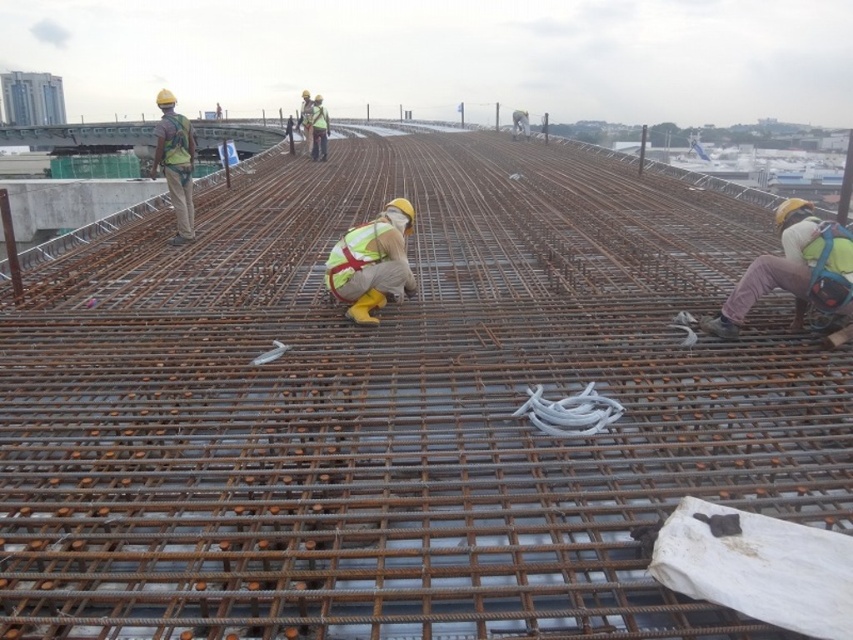
Question: Is light blue fabric at right above matte yellow safety vest at upper left?

Choices:
 (A) no
 (B) yes

Answer: (A)

Question: Does reflective safety vest at center lie in front of matte yellow safety vest at upper left?

Choices:
 (A) yes
 (B) no

Answer: (A)

Question: Which point appears farthest from the camera in this image?

Choices:
 (A) (399, 243)
 (B) (177, 154)
 (C) (804, 259)

Answer: (B)

Question: Among these points, which one is farthest from the camera?

Choices:
 (A) click(805, 276)
 (B) click(409, 221)
 (C) click(167, 129)

Answer: (C)

Question: Which point is closer to the camera?

Choices:
 (A) light blue fabric at right
 (B) matte yellow safety vest at upper left
 (C) reflective safety vest at center

Answer: (A)

Question: Is light blue fabric at right closer to the viewer compared to matte yellow safety vest at upper left?

Choices:
 (A) yes
 (B) no

Answer: (A)